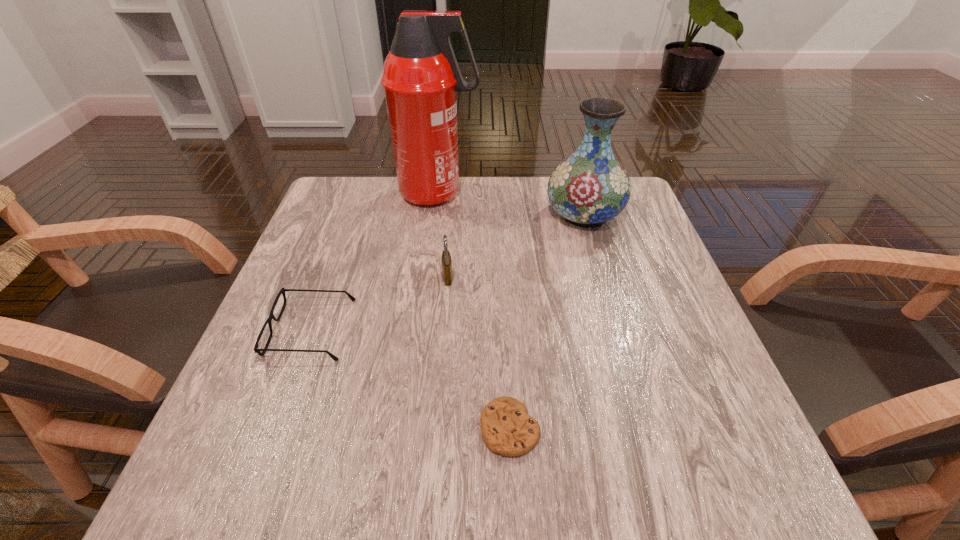
The width and height of the screenshot is (960, 540). I want to click on vacant area that lies between the second tallest object and the tallest object, so click(x=511, y=204).

The height and width of the screenshot is (540, 960). In order to click on vacant area that lies between the leftmost object and the third shortest object in this screenshot , I will do `click(379, 303)`.

Select which object is the fourth closest to the rightmost object. Please provide its 2D coordinates. Your answer should be formatted as a tuple, i.e. [(x, y)], where the tuple contains the x and y coordinates of a point satisfying the conditions above.

[(256, 349)]

The image size is (960, 540). I want to click on object that is the second closest one to the spectacles, so click(x=506, y=428).

Identify the location of vacant area in the image that satisfies the following two spatial constraints: 1. on the front-facing side of the second nearest object; 2. on the right side of the second tallest object. The height and width of the screenshot is (540, 960). (352, 214).

The image size is (960, 540). I want to click on free location that satisfies the following two spatial constraints: 1. on the trigger side of the rightmost object; 2. on the right side of the tallest object, so click(x=436, y=214).

Locate an element on the screen. free point that satisfies the following two spatial constraints: 1. on the trigger side of the tallest object; 2. on the left side of the third farthest object is located at coordinates (428, 277).

Where is `vacant point that satisfies the following two spatial constraints: 1. on the back side of the vase; 2. on the right side of the nearest object`? The height and width of the screenshot is (540, 960). vacant point that satisfies the following two spatial constraints: 1. on the back side of the vase; 2. on the right side of the nearest object is located at coordinates (498, 214).

Where is `free space in the image that satisfies the following two spatial constraints: 1. on the trigger side of the tallest object; 2. on the right side of the cookie`? free space in the image that satisfies the following two spatial constraints: 1. on the trigger side of the tallest object; 2. on the right side of the cookie is located at coordinates (409, 429).

The width and height of the screenshot is (960, 540). Identify the location of vacant position in the image that satisfies the following two spatial constraints: 1. on the trigger side of the tallest object; 2. on the left side of the rightmost object. (436, 214).